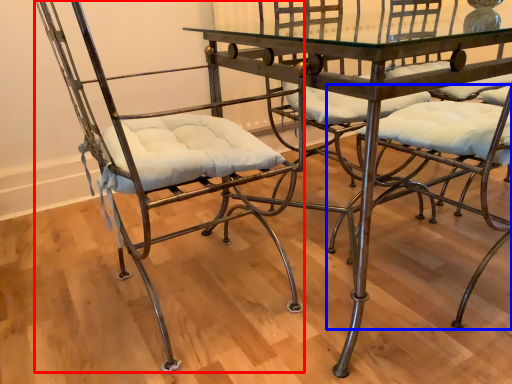
Question: Which object appears farthest to the camera in this image, chair (highlighted by a red box) or chair (highlighted by a blue box)?

Choices:
 (A) chair
 (B) chair

Answer: (B)